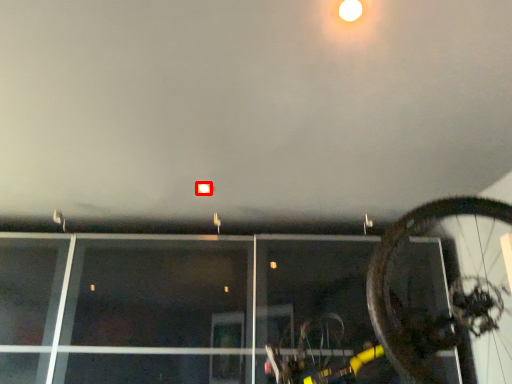
Question: Where is droplight (annotated by the red box) located in relation to bicycle in the image?

Choices:
 (A) left
 (B) right

Answer: (A)